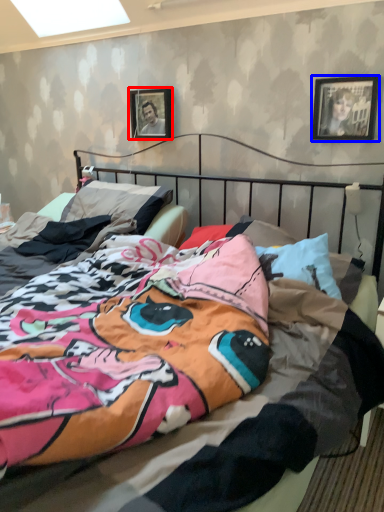
Question: Which of the following is the farthest to the observer, picture frame (highlighted by a red box) or picture frame (highlighted by a blue box)?

Choices:
 (A) picture frame
 (B) picture frame

Answer: (A)